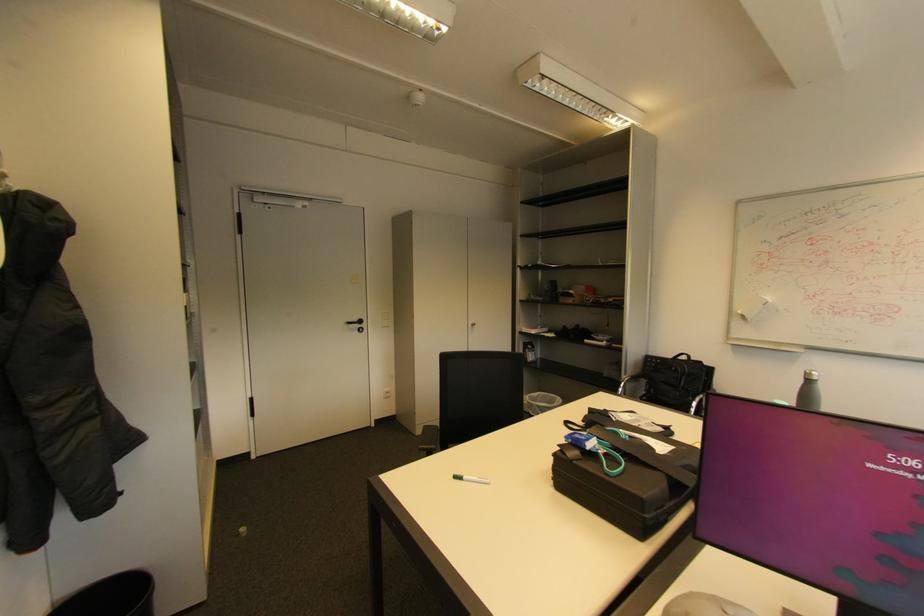
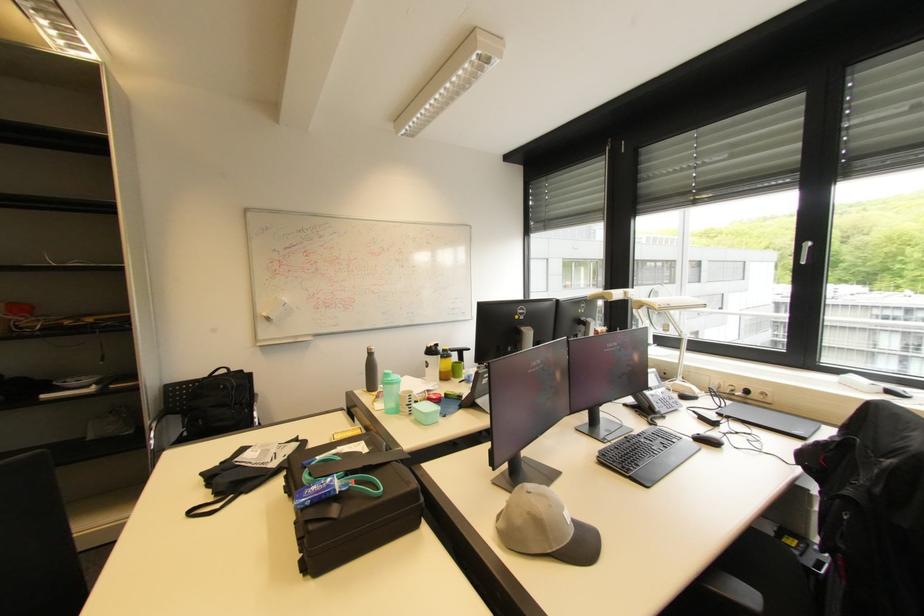
The point at [578,444] is marked in the first image. Where is the corresponding point in the second image?

(321, 501)